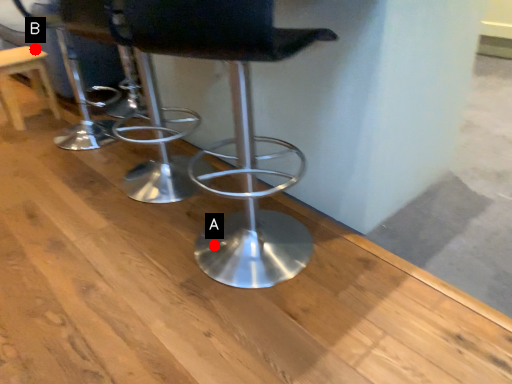
Question: Two points are circled on the image, labeled by A and B beside each circle. Which point appears closest to the camera in this image?

Choices:
 (A) A is closer
 (B) B is closer

Answer: (A)